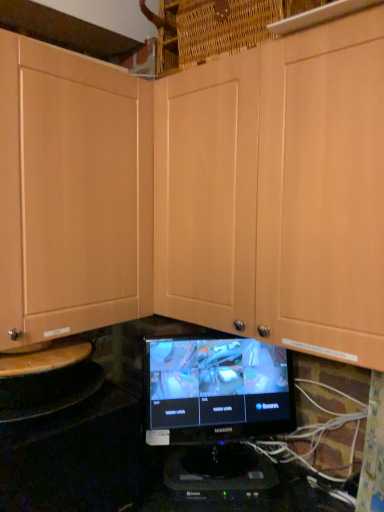
Question: Is black plastic monitor at center not inside black glossy monitor at center?

Choices:
 (A) no
 (B) yes

Answer: (B)

Question: Does black plastic monitor at center have a larger size compared to black glossy monitor at center?

Choices:
 (A) no
 (B) yes

Answer: (A)

Question: Is black glossy monitor at center a part of black plastic monitor at center?

Choices:
 (A) no
 (B) yes

Answer: (A)

Question: Is black plastic monitor at center to the left of black glossy monitor at center from the viewer's perspective?

Choices:
 (A) no
 (B) yes

Answer: (B)

Question: From a real-world perspective, is black plastic monitor at center positioned over black glossy monitor at center based on gravity?

Choices:
 (A) no
 (B) yes

Answer: (A)

Question: From the image's perspective, is black plastic monitor at center positioned above or below black glossy monitor at center?

Choices:
 (A) below
 (B) above

Answer: (A)

Question: Relative to black glossy monitor at center, is black plastic monitor at center in front or behind?

Choices:
 (A) behind
 (B) front

Answer: (A)

Question: Is black plastic monitor at center bigger or smaller than black glossy monitor at center?

Choices:
 (A) big
 (B) small

Answer: (B)

Question: Is black plastic monitor at center to the left or to the right of black glossy monitor at center in the image?

Choices:
 (A) right
 (B) left

Answer: (B)

Question: Is matte wood cabinet at center taller or shorter than black glossy monitor at center?

Choices:
 (A) short
 (B) tall

Answer: (B)

Question: From the image's perspective, is matte wood cabinet at center above or below black glossy monitor at center?

Choices:
 (A) below
 (B) above

Answer: (B)

Question: In terms of size, does matte wood cabinet at center appear bigger or smaller than black glossy monitor at center?

Choices:
 (A) big
 (B) small

Answer: (A)

Question: Considering the positions of point (135, 202) and point (231, 384), is point (135, 202) closer or farther from the camera than point (231, 384)?

Choices:
 (A) closer
 (B) farther

Answer: (B)

Question: Choose the correct answer: Is black plastic monitor at center inside matte wood cabinet at center or outside it?

Choices:
 (A) inside
 (B) outside

Answer: (B)

Question: From a real-world perspective, is black plastic monitor at center above or below matte wood cabinet at center?

Choices:
 (A) below
 (B) above

Answer: (A)